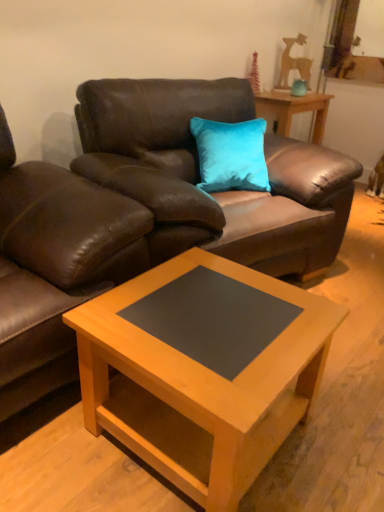
Question: Is teal velvet vase at upper right wider than brown leather couch at upper center?

Choices:
 (A) yes
 (B) no

Answer: (B)

Question: Is teal velvet vase at upper right aimed at brown leather couch at upper center?

Choices:
 (A) no
 (B) yes

Answer: (A)

Question: From the image's perspective, does teal velvet vase at upper right appear lower than brown leather couch at upper center?

Choices:
 (A) no
 (B) yes

Answer: (A)

Question: Does teal velvet vase at upper right have a greater height compared to brown leather couch at upper center?

Choices:
 (A) yes
 (B) no

Answer: (B)

Question: Is teal velvet vase at upper right bigger than brown leather couch at upper center?

Choices:
 (A) no
 (B) yes

Answer: (A)

Question: From a real-world perspective, is teal velvet vase at upper right below brown leather couch at upper center?

Choices:
 (A) yes
 (B) no

Answer: (B)

Question: Is teal velvet vase at upper right inside brown leather couch at upper center?

Choices:
 (A) no
 (B) yes

Answer: (A)

Question: Considering the relative sizes of brown leather couch at upper center and teal velvet vase at upper right in the image provided, is brown leather couch at upper center shorter than teal velvet vase at upper right?

Choices:
 (A) yes
 (B) no

Answer: (B)

Question: Can you confirm if brown leather couch at upper center is positioned to the left of teal velvet vase at upper right?

Choices:
 (A) no
 (B) yes

Answer: (B)

Question: From the image's perspective, would you say brown leather couch at upper center is positioned over teal velvet vase at upper right?

Choices:
 (A) no
 (B) yes

Answer: (A)

Question: Considering the relative positions of brown leather couch at upper center and teal velvet vase at upper right in the image provided, is brown leather couch at upper center in front of teal velvet vase at upper right?

Choices:
 (A) yes
 (B) no

Answer: (A)

Question: Is brown leather couch at upper center taller than teal velvet vase at upper right?

Choices:
 (A) yes
 (B) no

Answer: (A)

Question: From a real-world perspective, does wooden table at center stand above brown leather swivel chair at left?

Choices:
 (A) yes
 (B) no

Answer: (A)